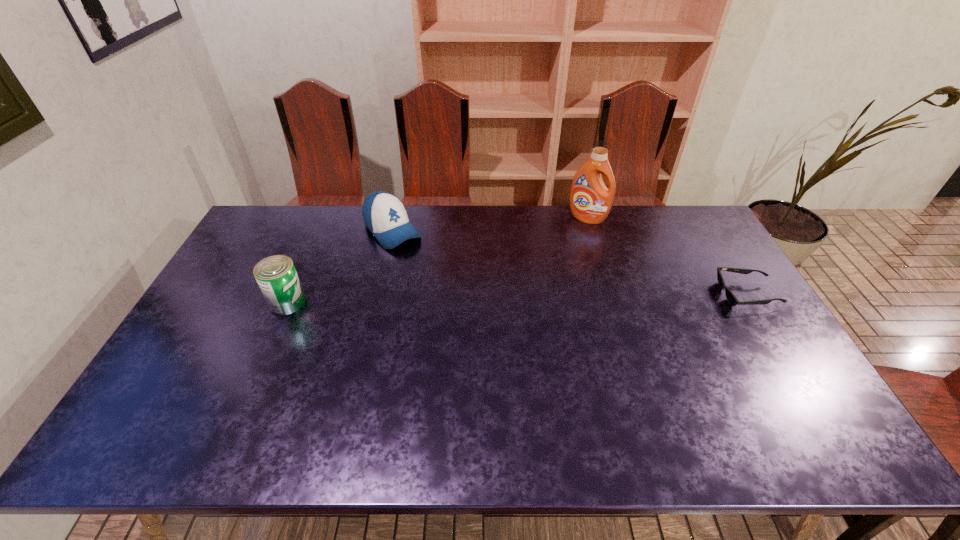
Image resolution: width=960 pixels, height=540 pixels. What are the coordinates of `vacant space located on the front-facing side of the baseball cap` in the screenshot? It's located at 431,274.

Find the location of a particular element. This screenshot has height=540, width=960. free space located 0.250m on the front-facing side of the baseball cap is located at coordinates (445, 290).

I want to click on blank space located on the front-facing side of the baseball cap, so click(464, 309).

The image size is (960, 540). What are the coordinates of `vacant space situated on the front-facing side of the second object from right to left` in the screenshot? It's located at pos(555,268).

This screenshot has height=540, width=960. Identify the location of vacant point located 0.140m on the front-facing side of the second object from right to left. (567, 246).

This screenshot has height=540, width=960. Identify the location of blank space located on the front-facing side of the second object from right to left. (550, 275).

Where is `baseball cap located at the far edge`? The image size is (960, 540). baseball cap located at the far edge is located at coordinates (384, 215).

Where is `detergent at the far edge`? This screenshot has height=540, width=960. detergent at the far edge is located at coordinates (590, 200).

I want to click on object that is at the right edge, so click(733, 301).

At what (x,y) coordinates should I click in order to perform the action: click on vacant space at the far edge of the desktop. Please return your answer as a coordinate pair (x, y). Looking at the image, I should click on (467, 218).